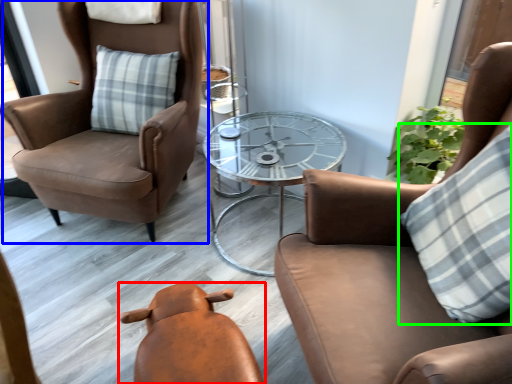
Question: Based on their relative distances, which object is nearer to chair (highlighted by a red box)? Choose from chair (highlighted by a blue box) and pillow (highlighted by a green box).

Choices:
 (A) chair
 (B) pillow

Answer: (B)